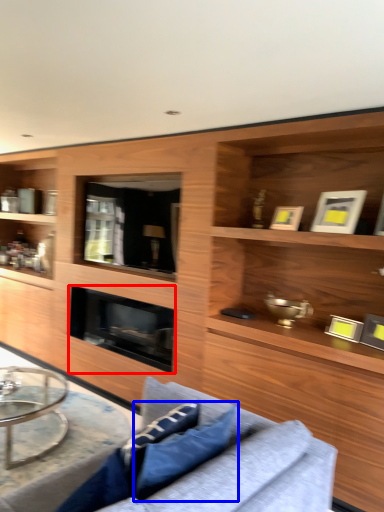
Question: Among these objects, which one is farthest to the camera, fireplace (highlighted by a red box) or pillow (highlighted by a blue box)?

Choices:
 (A) fireplace
 (B) pillow

Answer: (A)